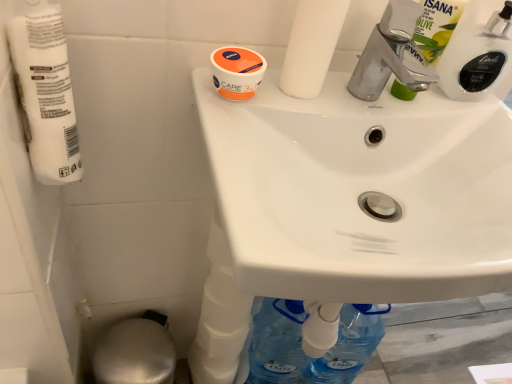
Question: From the image's perspective, is white matte toilet paper at left, the 1th toilet paper when ordered from left to right, positioned above or below white matte toilet paper at upper center, which ranks as the second toilet paper in left-to-right order?

Choices:
 (A) below
 (B) above

Answer: (A)

Question: Is white matte toilet paper at left, the 2th toilet paper in the right-to-left sequence, to the left or to the right of white matte toilet paper at upper center, which ranks as the second toilet paper in left-to-right order, in the image?

Choices:
 (A) right
 (B) left

Answer: (B)

Question: Considering the real-world distances, which object is farthest from the orange matte jar at upper center?

Choices:
 (A) white glossy sink at upper center
 (B) white matte toilet paper at upper center, the 1th toilet paper positioned from the right
 (C) white glossy bottle at upper right, marked as the 2th cleaning product in a left-to-right arrangement
 (D) green plastic bottle at upper right, positioned as the 1th cleaning product in left-to-right order
 (E) white matte toilet paper at left, the 2th toilet paper in the right-to-left sequence

Answer: (C)

Question: Which object is positioned closest to the white matte toilet paper at upper center, the 1th toilet paper positioned from the right?

Choices:
 (A) orange matte jar at upper center
 (B) silver metallic bidet at lower left
 (C) green plastic bottle at upper right, positioned as the 1th cleaning product in left-to-right order
 (D) white glossy bottle at upper right, which is counted as the first cleaning product, starting from the right
 (E) white glossy sink at upper center

Answer: (A)